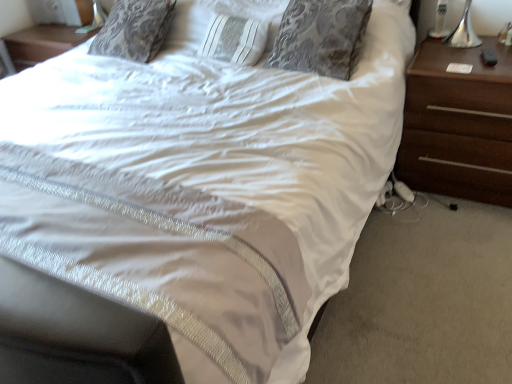
Question: Is silver damask pillow at upper center turned away from brown wood nightstand at right?

Choices:
 (A) yes
 (B) no

Answer: (B)

Question: Is silver damask pillow at upper center not within brown wood nightstand at right?

Choices:
 (A) yes
 (B) no

Answer: (A)

Question: Does silver damask pillow at upper center turn towards brown wood nightstand at right?

Choices:
 (A) no
 (B) yes

Answer: (A)

Question: Is silver damask pillow at upper center taller than brown wood nightstand at right?

Choices:
 (A) yes
 (B) no

Answer: (B)

Question: Is silver damask pillow at upper center far away from brown wood nightstand at right?

Choices:
 (A) no
 (B) yes

Answer: (A)

Question: Considering the relative positions of silver damask pillow at upper center and brown wood nightstand at right in the image provided, is silver damask pillow at upper center to the left of brown wood nightstand at right from the viewer's perspective?

Choices:
 (A) no
 (B) yes

Answer: (B)

Question: Is brown wood nightstand at right closer to camera compared to silver damask pillow at upper center?

Choices:
 (A) no
 (B) yes

Answer: (B)

Question: Can you confirm if brown wood nightstand at right is taller than silver damask pillow at upper center?

Choices:
 (A) no
 (B) yes

Answer: (B)

Question: Is brown wood nightstand at right positioned behind silver damask pillow at upper center?

Choices:
 (A) yes
 (B) no

Answer: (B)

Question: From a real-world perspective, is brown wood nightstand at right beneath silver damask pillow at upper center?

Choices:
 (A) no
 (B) yes

Answer: (B)

Question: Is brown wood nightstand at right wider than silver damask pillow at upper center?

Choices:
 (A) no
 (B) yes

Answer: (B)

Question: Does brown wood nightstand at right have a lesser width compared to silver damask pillow at upper center?

Choices:
 (A) no
 (B) yes

Answer: (A)

Question: From the image's perspective, is silver damask pillow at upper center positioned above or below brown wood nightstand at right?

Choices:
 (A) above
 (B) below

Answer: (A)